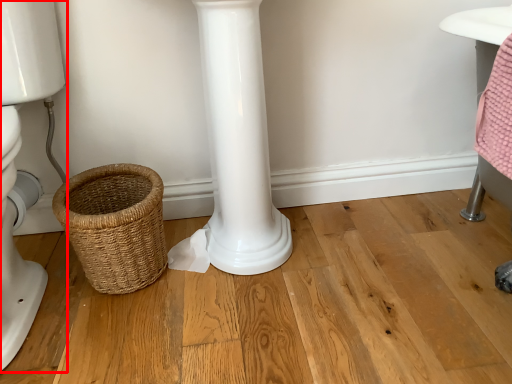
Question: Considering the relative positions of toilet (annotated by the red box) and basket in the image provided, where is toilet (annotated by the red box) located with respect to the staircase?

Choices:
 (A) left
 (B) right

Answer: (A)